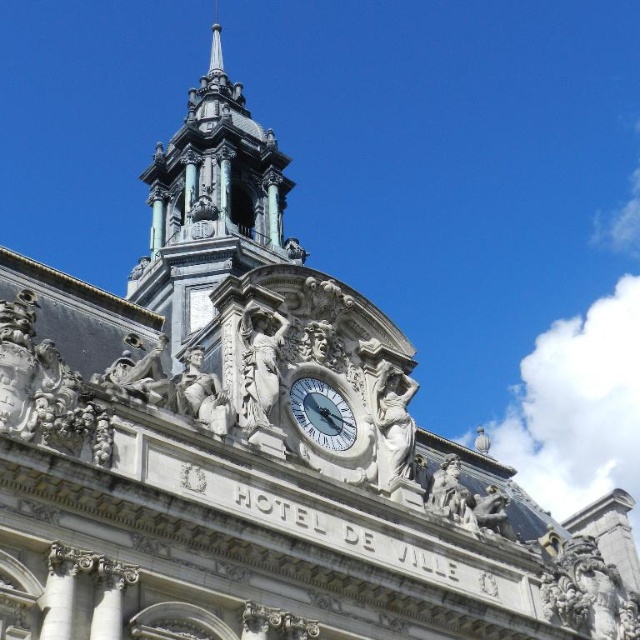
You are an architect analyzing the Hotel de Ville facade. You need to determine which object has a greater width between the polished bronze spire at upper center and the white marble clock at center. Based on the scene, which one is wider?

The polished bronze spire at upper center is wider than the white marble clock at center.

You are standing 100 meters away from the Hotel de Ville. You want to take a photo of the point at coordinates point (253, 138). Is the point within your camera view if your camera has a maximum range of 80 meters?

The distance of point (253, 138) is 85.01 meters from the camera, which exceeds the camera maximum range of 80 meters. Therefore, the point is out of the camera view.

You are an architect planning to install a new decorative element between the polished bronze spire at upper center and the white marble clock at center. The element requires a minimum of 10 meters of space. Can the available distance accommodate this requirement?

The distance between the polished bronze spire at upper center and the white marble clock at center is 11.32 meters, which exceeds the required 10 meters. Therefore, the decorative element can be installed between them.